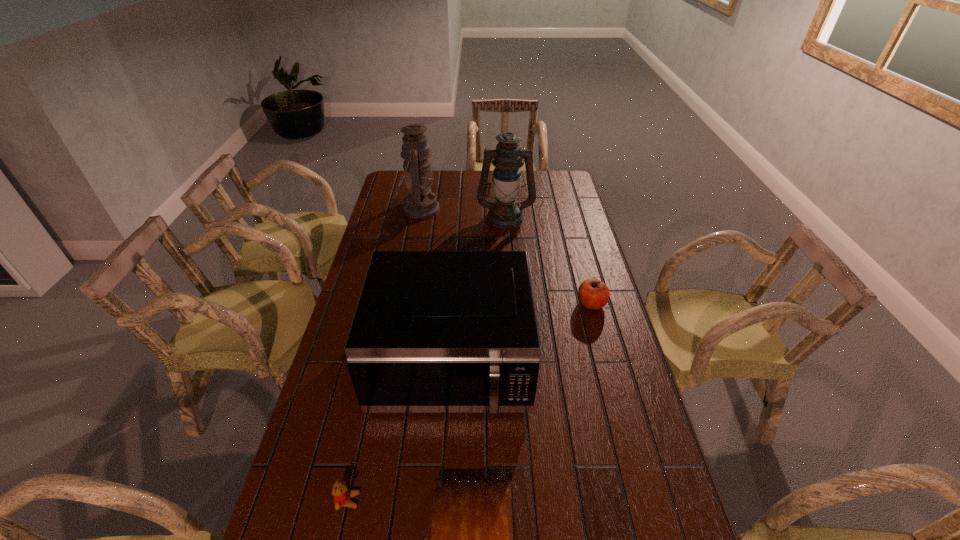
This screenshot has height=540, width=960. In order to click on free space located 0.090m on the left of the rightmost object in this screenshot , I will do `click(552, 303)`.

Locate an element on the screen. vacant region located 0.280m on the front-facing side of the teddy bear is located at coordinates (476, 500).

Locate an element on the screen. oil lamp situated at the left edge is located at coordinates (420, 203).

Identify the location of microwave_oven positioned at the left edge. (434, 331).

Image resolution: width=960 pixels, height=540 pixels. I want to click on teddy bear at the left edge, so click(x=342, y=495).

Find the location of a particular element. Image resolution: width=960 pixels, height=540 pixels. object present at the right edge is located at coordinates (593, 294).

You are a GUI agent. You are given a task and a screenshot of the screen. Output one action in this format:
    pyautogui.click(x=<x>, y=<y>)
    Task: Click on the vacant space at the far edge of the desktop
    
    Given the screenshot: What is the action you would take?
    pyautogui.click(x=526, y=185)

What are the coordinates of `free space at the left edge of the desktop` in the screenshot? It's located at (357, 294).

Locate an element on the screen. Image resolution: width=960 pixels, height=540 pixels. vacant region at the right edge of the desktop is located at coordinates (623, 512).

Identify the location of vacant space at the far left corner of the desktop. (397, 184).